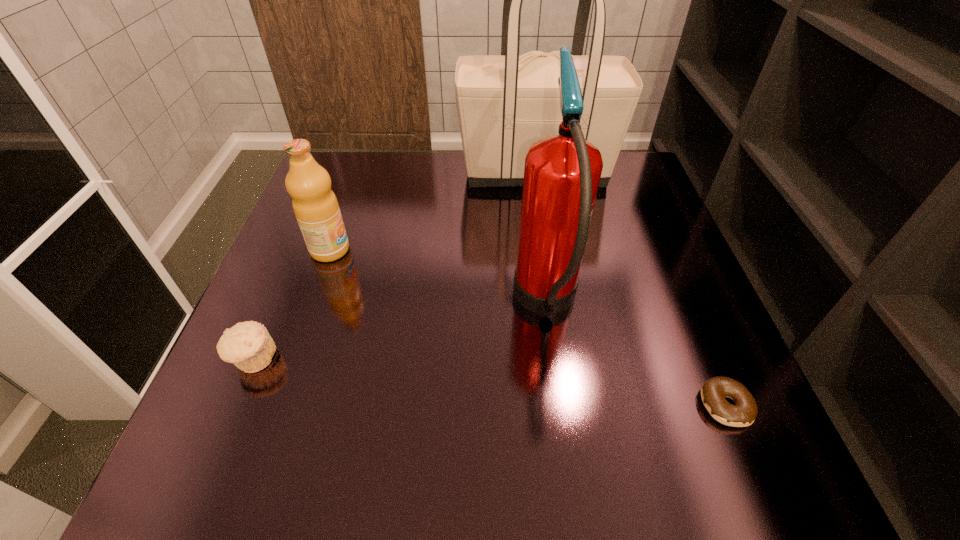
Find the location of a particular element. This screenshot has height=540, width=960. free location located on the front label of the fruit juice is located at coordinates coord(471,250).

This screenshot has width=960, height=540. What are the coordinates of `vacant space located 0.400m on the back of the muffin` in the screenshot? It's located at (316, 211).

Where is `vacant space situated on the back of the nearest object`? vacant space situated on the back of the nearest object is located at coordinates (675, 282).

Locate an element on the screen. The width and height of the screenshot is (960, 540). object present at the far edge is located at coordinates (505, 103).

Find the location of a particular element. This screenshot has height=540, width=960. fruit juice that is at the left edge is located at coordinates (316, 208).

Identify the location of muffin present at the left edge. The width and height of the screenshot is (960, 540). (248, 345).

Where is `shopping bag at the right edge`? This screenshot has width=960, height=540. shopping bag at the right edge is located at coordinates (505, 103).

Image resolution: width=960 pixels, height=540 pixels. I want to click on doughnut at the right edge, so click(x=742, y=414).

You are a GUI agent. You are given a task and a screenshot of the screen. Output one action in this format:
    pyautogui.click(x=<x>, y=<y>)
    Task: Click on the object located at the far right corner
    Image resolution: width=960 pixels, height=540 pixels.
    Given the screenshot: What is the action you would take?
    pyautogui.click(x=505, y=103)

In the image, there is a desktop. Where is `vacant space at the far edge`? The width and height of the screenshot is (960, 540). vacant space at the far edge is located at coordinates (399, 162).